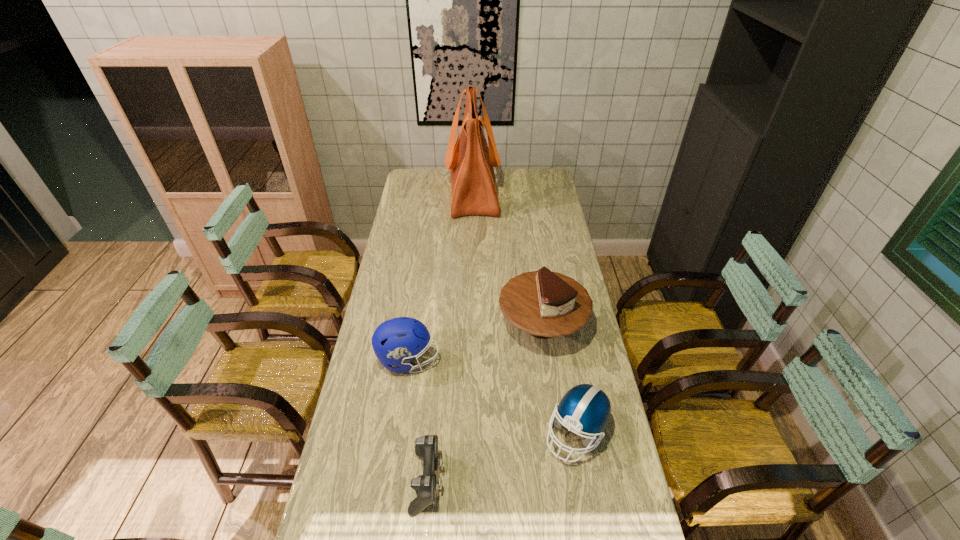
Identify the location of free area in between the shortest object and the left football helmet. (419, 420).

This screenshot has width=960, height=540. Identify the location of free spot between the cake and the left football helmet. (475, 343).

Where is `free space between the control and the cake`? free space between the control and the cake is located at coordinates (485, 403).

Where is `unoccupied area between the fourth tallest object and the control`? This screenshot has width=960, height=540. unoccupied area between the fourth tallest object and the control is located at coordinates (502, 456).

This screenshot has width=960, height=540. Identify the location of free spot between the shorter football helmet and the cake. (559, 379).

Image resolution: width=960 pixels, height=540 pixels. In order to click on free space between the shopping bag and the farther football helmet in this screenshot , I will do `click(441, 276)`.

Locate an element on the screen. empty space between the control and the tallest object is located at coordinates (450, 336).

Locate which object is the third closest to the shopping bag. Please provide its 2D coordinates. Your answer should be formatted as a tuple, i.e. [(x, y)], where the tuple contains the x and y coordinates of a point satisfying the conditions above.

[(585, 408)]

The height and width of the screenshot is (540, 960). I want to click on object that stands as the third closest to the control, so click(545, 304).